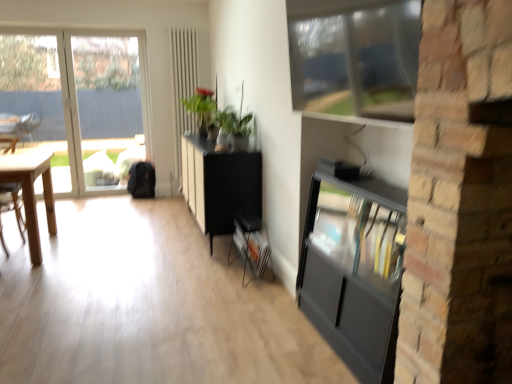
At what (x,y) coordinates should I click in order to perform the action: click on vacant space in front of metallic gray magazine rack at center. Please return your answer as a coordinate pair (x, y). Looking at the image, I should click on click(x=243, y=289).